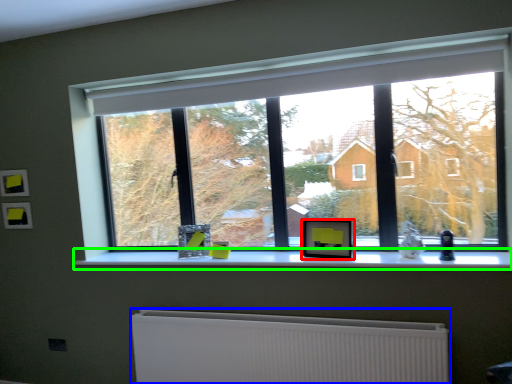
Question: Estimate the real-world distances between objects in this image. Which object is closer to picture frame (highlighted by a red box), radiator (highlighted by a blue box) or window sill (highlighted by a green box)?

Choices:
 (A) radiator
 (B) window sill

Answer: (B)